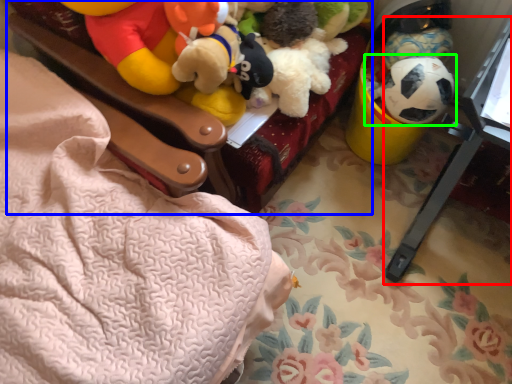
Question: Based on their relative distances, which object is farther from changing table (highlighted by a red box)? Choose from furniture (highlighted by a blue box) and toy (highlighted by a green box).

Choices:
 (A) furniture
 (B) toy

Answer: (A)